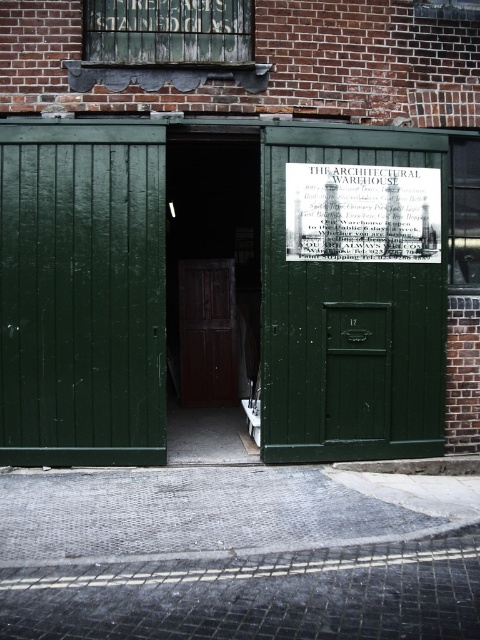
You are standing in a city street and see the image. You need to walk to the paved stone alley at center. Which direction should you walk relative to your current position?

The paved stone alley at center is located at point coordinates of (238, 554). Since the coordinate system typically places (0, 0) at the bottom left corner, the paved stone alley at center is positioned towards the right side of the image. Therefore, you should walk to the right to reach the paved stone alley at center.

You are standing in front of the entrance of THE ARCHITECTURAL WAREHOUSE. You want to reach a point marked at coordinates point (354,221) inside the warehouse. Considering the open entrance, can you walk straight from the entrance to that point without needing to turn?

The point (354,221) is 22.98 feet away from the viewer. Since the entrance is open, you can walk straight from the entrance to the point without needing to turn.

You are standing in front of the building and want to enter the green wood door at center. However, there is another green wooden door at center in your way. Which door should you go through first?

You should go through the green wood door at center first because it is closer to you than the green wooden door at center, which is further away.